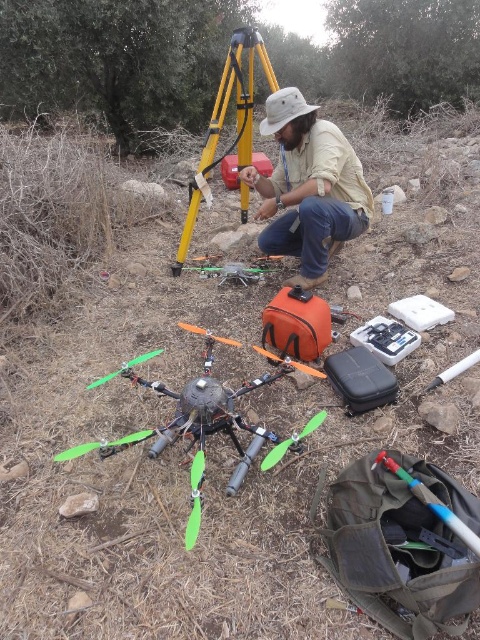
Question: Which of the following is the closest to the observer?

Choices:
 (A) (233, 61)
 (B) (283, 449)
 (C) (260, 131)
 (D) (204, 428)

Answer: (B)

Question: Which of the following is the closest to the observer?

Choices:
 (A) (361, 220)
 (B) (268, 456)
 (C) (178, 259)

Answer: (B)

Question: Does khaki cotton shirt at center have a larger size compared to green plastic propeller at center?

Choices:
 (A) no
 (B) yes

Answer: (B)

Question: Can you confirm if khaki cotton shirt at center is positioned to the right of yellow/yellowish metal tripod at center?

Choices:
 (A) no
 (B) yes

Answer: (B)

Question: Which object appears farthest from the camera in this image?

Choices:
 (A) green plastic drone at lower left
 (B) yellow/yellowish metal tripod at center

Answer: (B)

Question: Is green plastic drone at lower left to the left of green plastic propeller at center from the viewer's perspective?

Choices:
 (A) no
 (B) yes

Answer: (B)